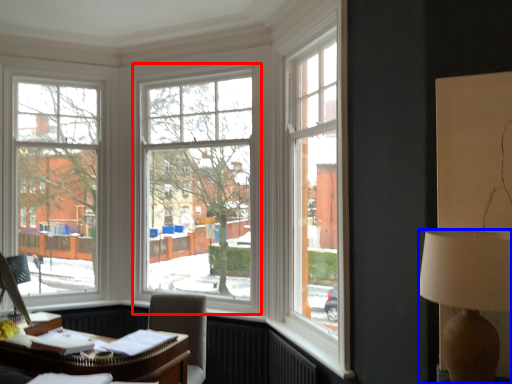
Question: Among these objects, which one is farthest to the camera, window (highlighted by a red box) or lamp (highlighted by a blue box)?

Choices:
 (A) window
 (B) lamp

Answer: (A)